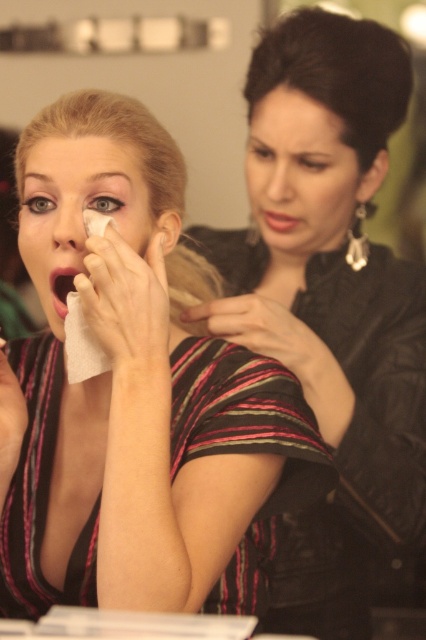
Does smooth skin face at center appear on the left side of matte red lipstick at center?

In fact, smooth skin face at center is to the right of matte red lipstick at center.

You are a GUI agent. You are given a task and a screenshot of the screen. Output one action in this format:
    pyautogui.click(x=<x>, y=<y>)
    Task: Click on the smooth skin face at center
    
    Given the screenshot: What is the action you would take?
    pyautogui.click(x=299, y=176)

Describe the element at coordinates (331, 253) in the screenshot. I see `black leather jacket at upper right` at that location.

Who is higher up, black leather jacket at upper right or matte black face at center?

matte black face at center is higher up.

This screenshot has height=640, width=426. Find the location of `black leather jacket at upper right`. black leather jacket at upper right is located at coordinates (331, 253).

At what (x,y) coordinates should I click in order to perform the action: click on black leather jacket at upper right. Please return your answer as a coordinate pair (x, y). Looking at the image, I should click on (331, 253).

Describe the element at coordinates (135, 396) in the screenshot. I see `matte black dress at center` at that location.

Can you confirm if matte black dress at center is smaller than matte red lipstick at center?

No.

Where is `matte black dress at center`? This screenshot has width=426, height=640. matte black dress at center is located at coordinates (135, 396).

Identify the location of matte black dress at center. (135, 396).